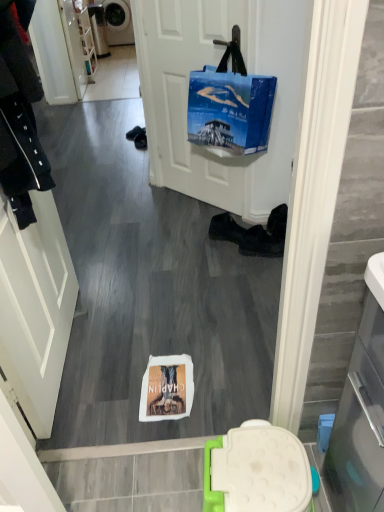
Locate an element on the screen. vacant area that lies between white glossy door at left and black leather shoe at lower center is located at coordinates (148, 300).